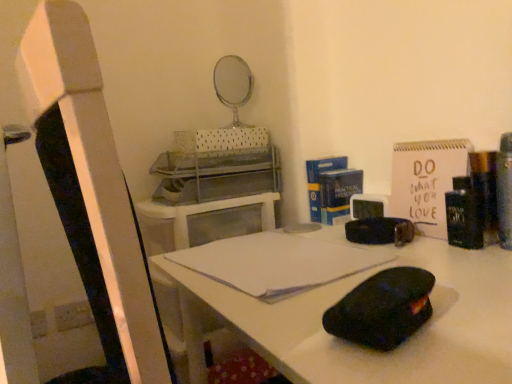
Question: Is black matte desk at center wider than white paper notebook at center?

Choices:
 (A) yes
 (B) no

Answer: (A)

Question: From the image's perspective, is black matte desk at center located beneath white paper notebook at center?

Choices:
 (A) yes
 (B) no

Answer: (A)

Question: Can white paper notebook at center be found inside black matte desk at center?

Choices:
 (A) yes
 (B) no

Answer: (A)

Question: Considering the relative sizes of black matte desk at center and white paper notebook at center in the image provided, is black matte desk at center smaller than white paper notebook at center?

Choices:
 (A) no
 (B) yes

Answer: (A)

Question: Is black matte desk at center not inside white paper notebook at center?

Choices:
 (A) no
 (B) yes

Answer: (B)

Question: Does black matte desk at center have a greater height compared to white paper notebook at center?

Choices:
 (A) no
 (B) yes

Answer: (B)

Question: Is white paper notebook at center positioned behind black matte desk at center?

Choices:
 (A) yes
 (B) no

Answer: (A)

Question: From a real-world perspective, is white paper notebook at center located beneath black matte desk at center?

Choices:
 (A) yes
 (B) no

Answer: (B)

Question: From the image's perspective, is white paper notebook at center located above black matte desk at center?

Choices:
 (A) no
 (B) yes

Answer: (B)

Question: Considering the relative sizes of white paper notebook at center and black matte desk at center in the image provided, is white paper notebook at center taller than black matte desk at center?

Choices:
 (A) no
 (B) yes

Answer: (A)

Question: From a real-world perspective, is white paper notebook at center on top of black matte desk at center?

Choices:
 (A) yes
 (B) no

Answer: (A)

Question: Can you confirm if white paper notebook at center is shorter than black matte desk at center?

Choices:
 (A) yes
 (B) no

Answer: (A)

Question: From a real-world perspective, is white paper notebook at center physically located above or below black matte desk at center?

Choices:
 (A) below
 (B) above

Answer: (B)